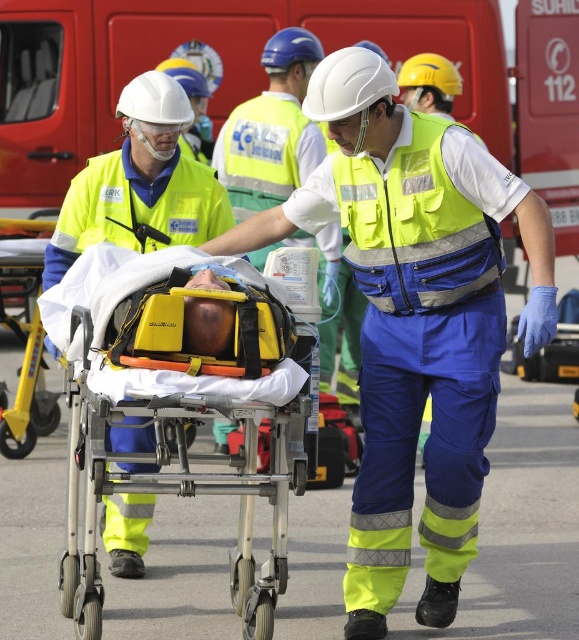
Image resolution: width=579 pixels, height=640 pixels. Find the location of `yellow plastic stretcher at center`. yellow plastic stretcher at center is located at coordinates (188, 419).

Can you confirm if yellow reflective vest at center is positioned above yellow plastic stretcher at lower left?

Yes.

Can you confirm if yellow reflective vest at center is shorter than yellow plastic stretcher at lower left?

In fact, yellow reflective vest at center may be taller than yellow plastic stretcher at lower left.

The width and height of the screenshot is (579, 640). Describe the element at coordinates (415, 320) in the screenshot. I see `yellow reflective vest at center` at that location.

Locate an element on the screen. yellow reflective vest at center is located at coordinates (415, 320).

In the scene shown: Which is above, yellow reflective vest at center or yellow plastic stretcher at center?

yellow reflective vest at center is higher up.

Who is positioned more to the left, yellow reflective vest at center or yellow plastic stretcher at center?

From the viewer's perspective, yellow plastic stretcher at center appears more on the left side.

Measure the distance between point (376, 200) and camera.

Point (376, 200) and camera are 24.42 feet apart.

Locate an element on the screen. The height and width of the screenshot is (640, 579). yellow reflective vest at center is located at coordinates (415, 320).